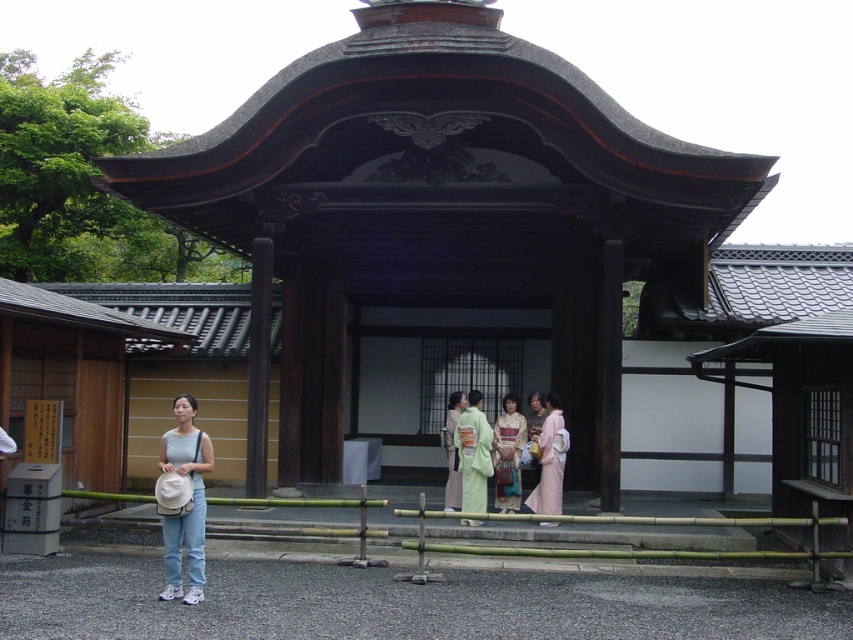
Question: Is light green silk kimono at center below silk kimono at center?

Choices:
 (A) no
 (B) yes

Answer: (B)

Question: Can you confirm if light green silk kimono at center is thinner than silk kimono at center?

Choices:
 (A) yes
 (B) no

Answer: (B)

Question: Which point is closer to the camera?

Choices:
 (A) (192, 451)
 (B) (445, 481)
 (C) (477, 412)
 (D) (514, 509)

Answer: (A)

Question: Is white fabric hat at lower left positioned before light beige kimono at center?

Choices:
 (A) yes
 (B) no

Answer: (A)

Question: Estimate the real-world distances between objects in this image. Which object is closer to the light beige kimono at center?

Choices:
 (A) light green silk kimono at center
 (B) pink silk kimono at center
 (C) silk kimono at center
 (D) white fabric hat at lower left

Answer: (A)

Question: Among these points, which one is farthest from the camera?

Choices:
 (A) (550, 394)
 (B) (193, 506)
 (C) (451, 506)
 (D) (483, 472)

Answer: (A)